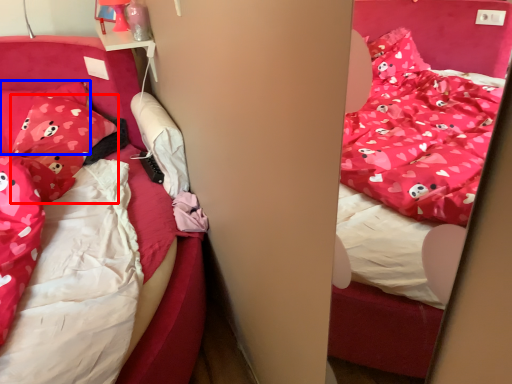
Question: Which of the following is the farthest to the observer, pillow (highlighted by a red box) or pillow (highlighted by a blue box)?

Choices:
 (A) pillow
 (B) pillow

Answer: (B)